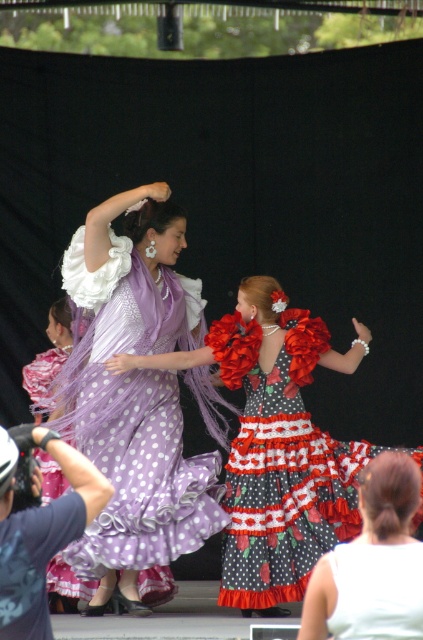
You are a photographer setting up for a dance performance. You need to ensure that both the lavender tulle dress at center and the red polka dot fabric dress at center are visible in your shot. Based on their positions, which dress might be partially hidden and why?

The red polka dot fabric dress at center might be partially hidden because the lavender tulle dress at center is positioned over it, blocking part of the view.

You are a photographer trying to capture the perfect shot of the two dancers. You notice two points marked in the image at coordinates point [208,472] and point [398,579]. Which point is closer to the camera?

Point [398,579] is closer to the camera because point [208,472] is behind it.

You are a photographer standing at the back of the stage where the two dancers are performing. You want to capture a photo that includes both the lavender tulle dress at center and the red polka dot fabric dress at center. If your camera has a maximum focus range of 30 inches, will you be able to focus on both dresses simultaneously?

The lavender tulle dress at center and red polka dot fabric dress at center are 30.25 inches apart from each other. Since the distance between them exceeds the camera maximum focus range of 30 inches, you cannot focus on both dresses simultaneously.